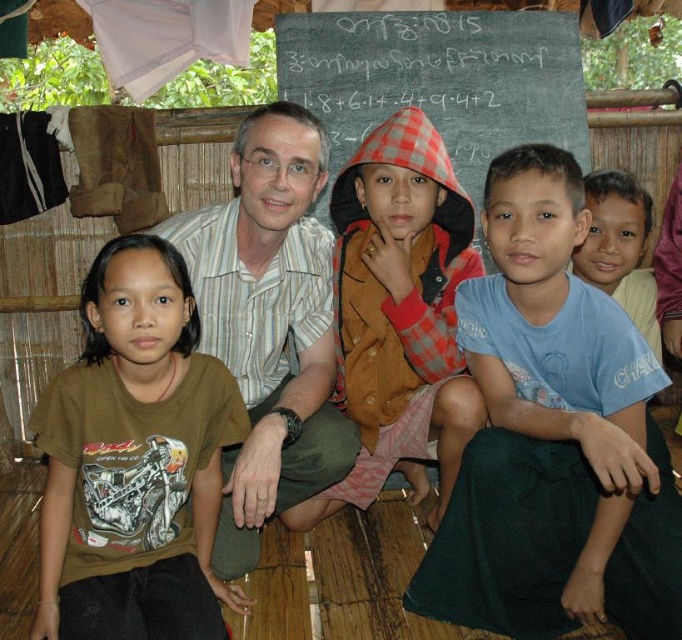
You are a visitor entering the room and notice the brown textured jacket at center and the blackboard at upper center. Which object is closer to you as you face the room?

The brown textured jacket at center is closer to you because it is in front of the blackboard at upper center.

You are standing in front of the blackboard in the classroom and notice two points marked on it. The first point is at coordinates point (x=261, y=186) and the second is at point (x=421, y=300). Which of these points is closer to you?

Point (x=261, y=186) is closer to the viewer than point (x=421, y=300).